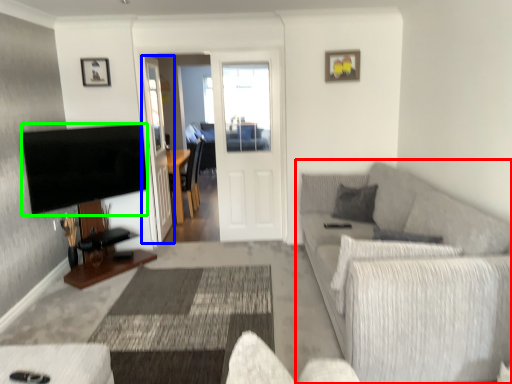
Question: Which is farther away from studio couch (highlighted by a red box)? glass door (highlighted by a blue box) or television (highlighted by a green box)?

Choices:
 (A) glass door
 (B) television

Answer: (A)